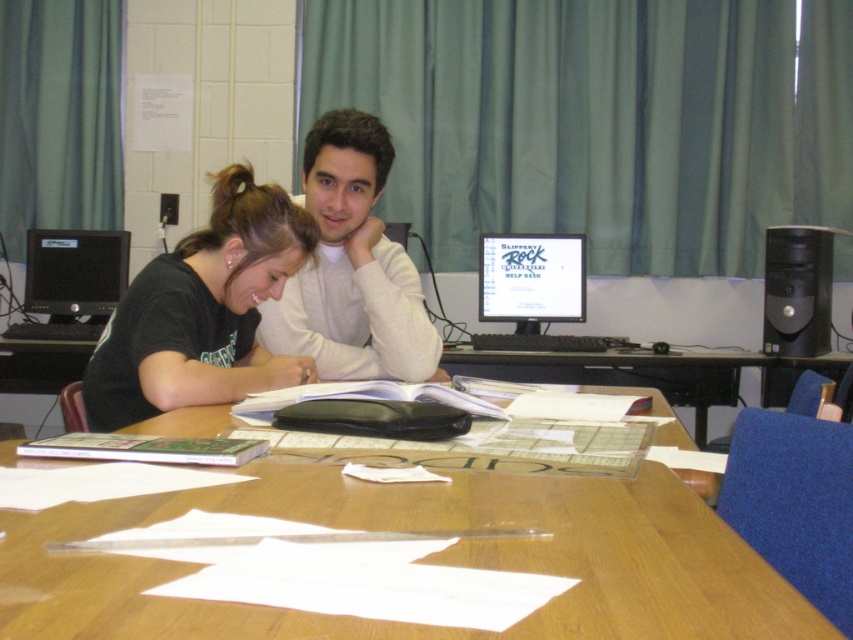
Question: Which point appears farthest from the camera in this image?

Choices:
 (A) (306, 195)
 (B) (317, 228)
 (C) (55, 310)

Answer: (C)

Question: Which point is closer to the camera taking this photo?

Choices:
 (A) (86, 234)
 (B) (682, 611)
 (C) (579, 292)

Answer: (B)

Question: Can you confirm if white matte sweater at center is bigger than matte black monitor at center?

Choices:
 (A) yes
 (B) no

Answer: (A)

Question: From the image, what is the correct spatial relationship of black matte shirt at upper left in relation to matte black monitor at left?

Choices:
 (A) left
 (B) right

Answer: (B)

Question: Is white matte sweater at center bigger than matte black monitor at center?

Choices:
 (A) yes
 (B) no

Answer: (A)

Question: Which object is the farthest from the matte black monitor at center?

Choices:
 (A) black matte shirt at upper left
 (B) white matte sweater at center
 (C) wooden table at center

Answer: (C)